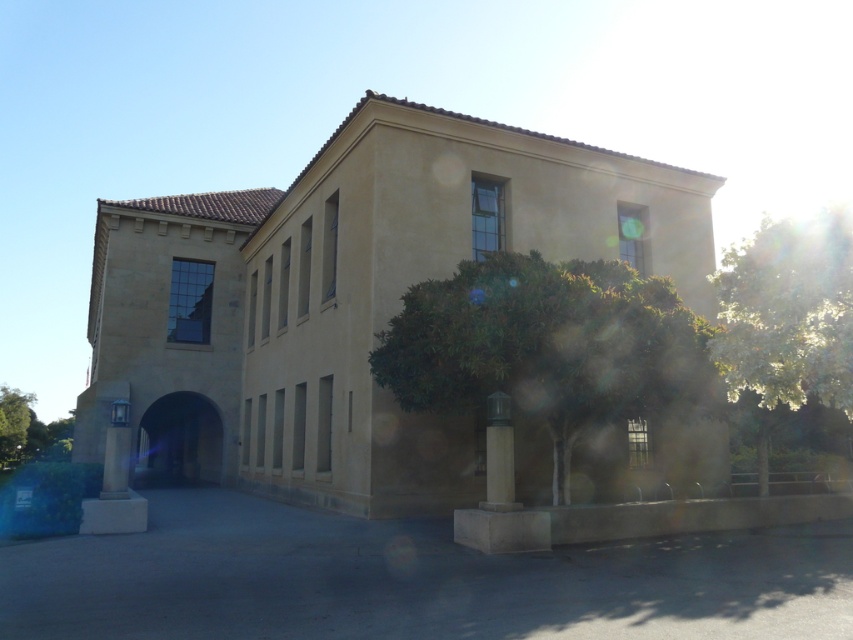
Question: Is green leafy tree at right closer to the viewer compared to green leafy tree at left?

Choices:
 (A) no
 (B) yes

Answer: (B)

Question: Does green leafy tree at center lie behind green leafy tree at left?

Choices:
 (A) yes
 (B) no

Answer: (B)

Question: Which point is closer to the camera?

Choices:
 (A) (764, 301)
 (B) (27, 420)
 (C) (413, 358)

Answer: (A)

Question: Considering the relative positions of green leafy tree at right and green leafy tree at left in the image provided, where is green leafy tree at right located with respect to green leafy tree at left?

Choices:
 (A) above
 (B) below

Answer: (A)

Question: Estimate the real-world distances between objects in this image. Which object is farther from the green leafy tree at right?

Choices:
 (A) green leafy tree at center
 (B) green leafy tree at left

Answer: (B)

Question: Which object appears farthest from the camera in this image?

Choices:
 (A) green leafy tree at left
 (B) green leafy tree at right

Answer: (A)